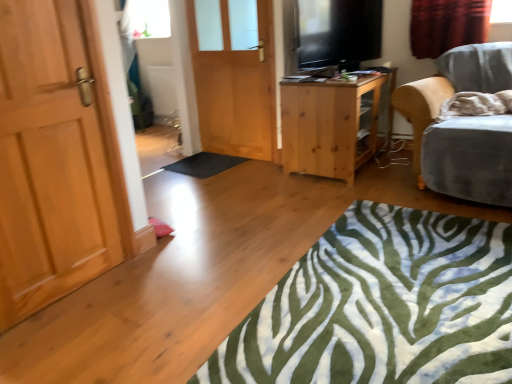
The image size is (512, 384). Describe the element at coordinates (447, 25) in the screenshot. I see `red velvet curtain at upper right` at that location.

What is the approximate height of flat screen tv at upper right?

flat screen tv at upper right is 52.85 centimeters tall.

Based on the photo, measure the distance between flat screen tv at upper right and camera.

flat screen tv at upper right is 10.22 feet from camera.

Identify the location of matte wooden door at center, which is counted as the second door, starting from the left. This screenshot has height=384, width=512. (236, 88).

At what (x,y) coordinates should I click in order to perform the action: click on light brown wooden table at center. Please return your answer as a coordinate pair (x, y). Looking at the image, I should click on (331, 125).

Is point (464, 345) positioned before point (372, 15)?

That is True.

Is flat screen tv at upper right at the back of green zebra-patterned rug at lower center?

No, green zebra-patterned rug at lower center's orientation is not away from flat screen tv at upper right.

Measure the distance between green zebra-patterned rug at lower center and flat screen tv at upper right.

They are 2.00 meters apart.

Is green zebra-patterned rug at lower center inside or outside of flat screen tv at upper right?

The correct answer is: outside.

From the image's perspective, between velvet grey chair at right and green zebra-patterned rug at lower center, who is located below?

green zebra-patterned rug at lower center is shown below in the image.

In terms of height, does velvet grey chair at right look taller or shorter compared to green zebra-patterned rug at lower center?

Clearly, velvet grey chair at right is taller compared to green zebra-patterned rug at lower center.

Which of these two, velvet grey chair at right or green zebra-patterned rug at lower center, is wider?

Wider between the two is velvet grey chair at right.

In the scene shown: Is velvet grey chair at right positioned beyond the bounds of green zebra-patterned rug at lower center?

Yes.

Locate an element on the screen. This screenshot has height=384, width=512. table above the green zebra-patterned rug at lower center (from the image's perspective) is located at coordinates (331, 125).

Do you think green zebra-patterned rug at lower center is within light brown wooden table at center, or outside of it?

green zebra-patterned rug at lower center lies outside light brown wooden table at center.

Can you confirm if green zebra-patterned rug at lower center is positioned to the right of light brown wooden table at center?

No, green zebra-patterned rug at lower center is not to the right of light brown wooden table at center.

Are green zebra-patterned rug at lower center and light brown wooden table at center far apart?

Yes.

Which of these two, black rubber mat at center or light brown wooden table at center, is smaller?

black rubber mat at center is smaller.

From a real-world perspective, is black rubber mat at center above or below light brown wooden table at center?

In terms of real-world spatial position, black rubber mat at center is below light brown wooden table at center.

Is black rubber mat at center beside light brown wooden table at center?

No, black rubber mat at center is not making contact with light brown wooden table at center.

Is light brown wooden table at center at the back of black rubber mat at center?

No, light brown wooden table at center is not at the back of black rubber mat at center.

Is flat screen tv at upper right facing away from black rubber mat at center?

No, flat screen tv at upper right is not facing away from black rubber mat at center.

From the picture: Is black rubber mat at center completely or partially inside flat screen tv at upper right?

No, black rubber mat at center is not inside flat screen tv at upper right.

From the picture: Is flat screen tv at upper right directly adjacent to black rubber mat at center?

No.

Which object is wider, red velvet curtain at upper right or matte wooden door at center, the 1th door positioned from the right?

red velvet curtain at upper right.

In terms of height, does red velvet curtain at upper right look taller or shorter compared to matte wooden door at center, which is the 1th door in back-to-front order?

Considering their sizes, red velvet curtain at upper right has less height than matte wooden door at center, which is the 1th door in back-to-front order.

From the image's perspective, which one is positioned higher, red velvet curtain at upper right or matte wooden door at center, which is counted as the second door, starting from the left?

red velvet curtain at upper right, from the image's perspective.

Which is in front, point (483, 12) or point (209, 107)?

The point (483, 12) is closer to the camera.

Between red velvet curtain at upper right and velvet grey chair at right, which one has smaller width?

red velvet curtain at upper right is thinner.

Looking at this image, is red velvet curtain at upper right at the left side of velvet grey chair at right?

Incorrect, red velvet curtain at upper right is not on the left side of velvet grey chair at right.

This screenshot has width=512, height=384. What are the coordinates of `level that is behind the green zebra-patterned rug at lower center` in the screenshot? It's located at (338, 32).

Locate an element on the screen. The width and height of the screenshot is (512, 384). plain below the velvet grey chair at right (from the image's perspective) is located at coordinates (382, 306).

Considering their positions, is matte wooden door at center, the 1th door positioned from the right, positioned further to black rubber mat at center than velvet grey chair at right?

velvet grey chair at right lies further to black rubber mat at center than the other object.

Which object lies further to the anchor point light brown wooden door at left, the second door positioned from the back, green zebra-patterned rug at lower center or black rubber mat at center?

Based on the image, black rubber mat at center appears to be further to light brown wooden door at left, the second door positioned from the back.

Looking at the image, which one is located closer to green zebra-patterned rug at lower center, matte wooden door at center, the 1th door positioned from the right, or light brown wooden table at center?

light brown wooden table at center is positioned closer to the anchor green zebra-patterned rug at lower center.

Which object lies further to the anchor point flat screen tv at upper right, matte wooden door at center, the second door positioned from the front, or green zebra-patterned rug at lower center?

green zebra-patterned rug at lower center is further to flat screen tv at upper right.

Looking at the image, which one is located closer to velvet grey chair at right, light brown wooden door at left, arranged as the second door when viewed from the right, or black rubber mat at center?

Among the two, black rubber mat at center is located nearer to velvet grey chair at right.

Considering their positions, is green zebra-patterned rug at lower center positioned further to light brown wooden door at left, the second door positioned from the back, than light brown wooden table at center?

light brown wooden table at center is further to light brown wooden door at left, the second door positioned from the back.

Looking at the image, which one is located further to flat screen tv at upper right, black rubber mat at center or light brown wooden door at left, arranged as the second door when viewed from the right?

light brown wooden door at left, arranged as the second door when viewed from the right, lies further to flat screen tv at upper right than the other object.

Looking at this image, when comparing their distances from black rubber mat at center, does red velvet curtain at upper right or flat screen tv at upper right seem further?

The object further to black rubber mat at center is red velvet curtain at upper right.

Where is `level between matte wooden door at center, the second door positioned from the front, and red velvet curtain at upper right from left to right`? Image resolution: width=512 pixels, height=384 pixels. level between matte wooden door at center, the second door positioned from the front, and red velvet curtain at upper right from left to right is located at coordinates (338, 32).

Identify the location of level between black rubber mat at center and light brown wooden table at center from left to right. point(338,32).

Identify the location of door between light brown wooden door at left, the 1th door from the left, and black rubber mat at center from front to back. This screenshot has height=384, width=512. (236, 88).

Locate an element on the screen. This screenshot has height=384, width=512. flat between light brown wooden door at left, arranged as the second door when viewed from the right, and velvet grey chair at right is located at coordinates (204, 164).